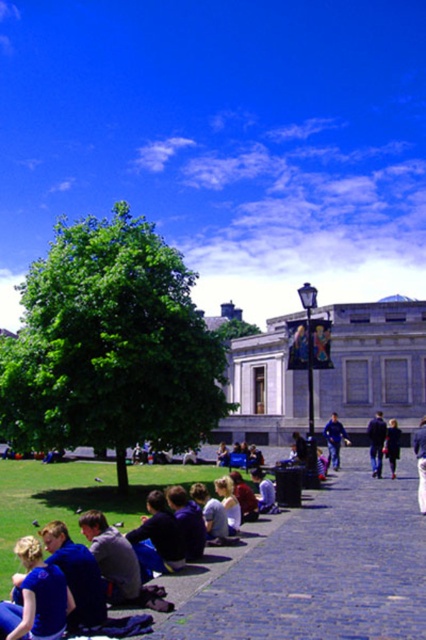
You are a photographer trying to capture a photo of the blue denim jeans at center without the dark blue shirt at lower left blocking the view. Is this possible based on their positions?

The dark blue shirt at lower left is in front of blue denim jeans at center, so it would block the view. To capture the blue denim jeans at center without obstruction, you need to move around the dark blue shirt at lower left or adjust your angle to avoid it.

Consider the image. You are standing at the point closest to the camera in the image. Which of the two points, point (20, 480) or point (57, 589), is farther away from you?

Point (20, 480) is behind point (57, 589), so it is farther away from you.

You are standing on the paved area and notice the green grass at lower left and the blue fabric shirt at lower left. Which object is located more to the left side?

The green grass at lower left is more on the left side.